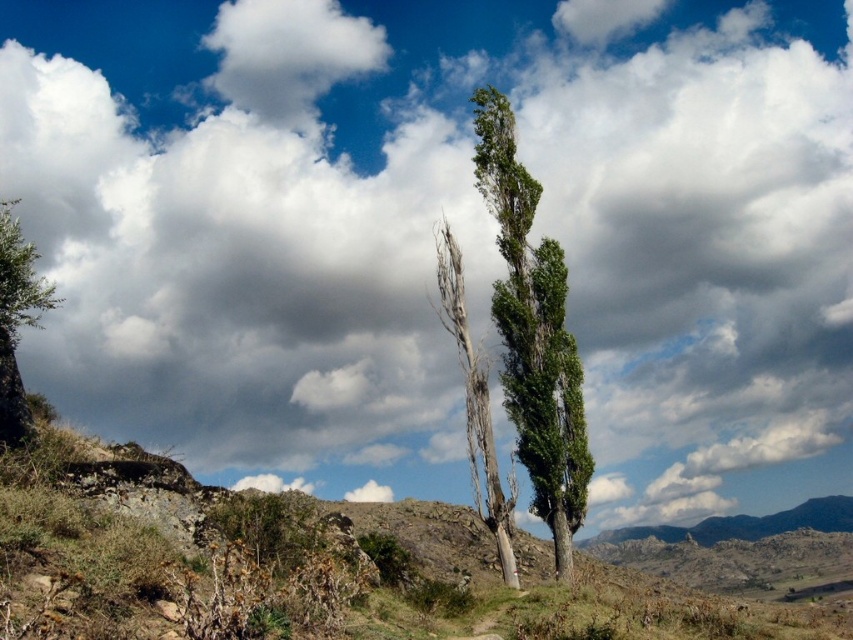
Which is behind, point (515, 333) or point (27, 324)?

The point (515, 333) is behind.

Is green leafy tree at center below green leafy tree at left?

Correct, green leafy tree at center is located below green leafy tree at left.

Is point (576, 436) closer to viewer compared to point (24, 432)?

No, (576, 436) is further to viewer.

I want to click on green leafy tree at center, so click(532, 333).